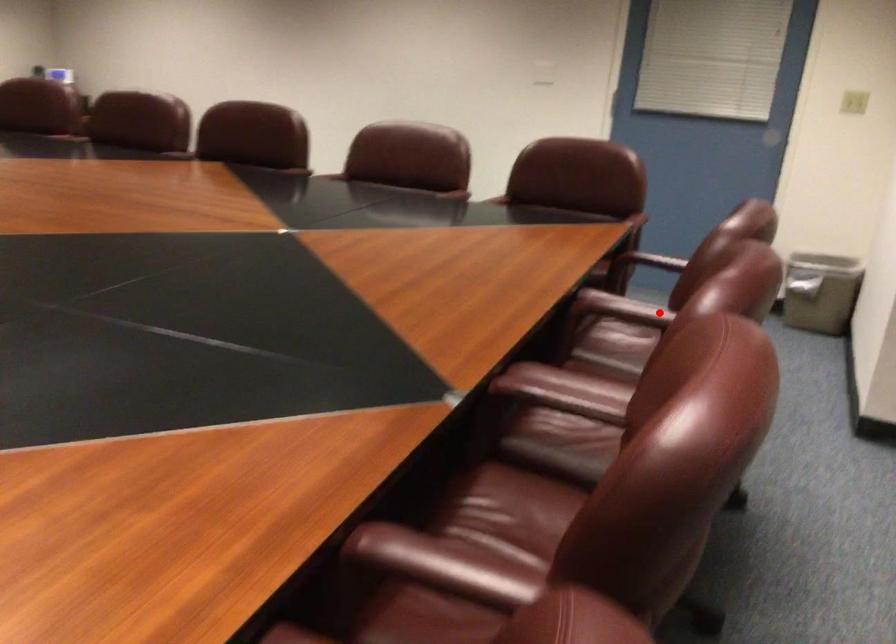
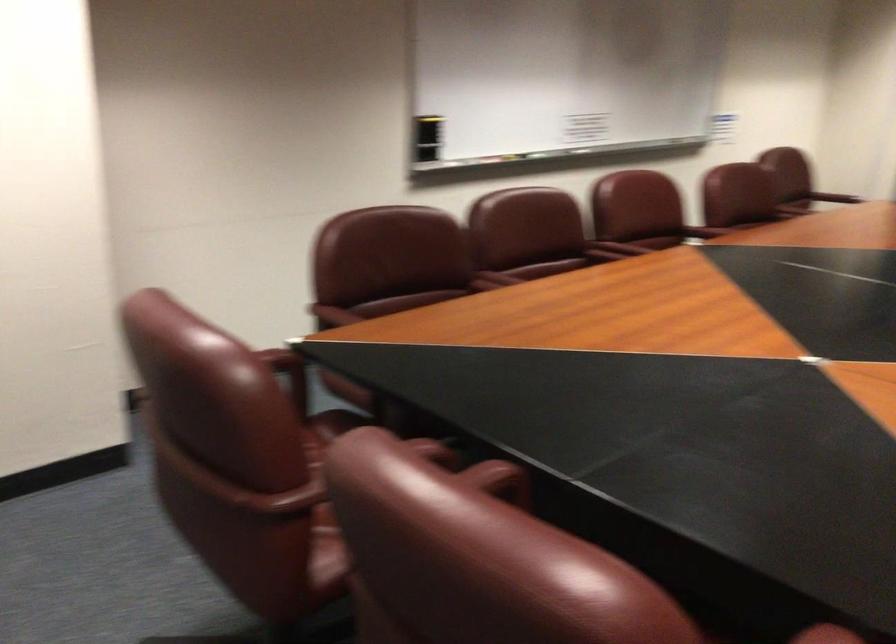
Question: I am providing you with two images of the same scene from different viewpoints. A red point is marked on the first image. Is the red point's position out of view in image 2?

Choices:
 (A) Yes
 (B) No

Answer: (B)